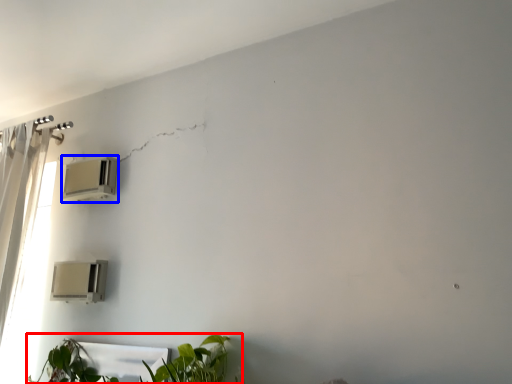
Question: Which of the following is the closest to the observer, houseplant (highlighted by a red box) or air conditioning (highlighted by a blue box)?

Choices:
 (A) houseplant
 (B) air conditioning

Answer: (A)